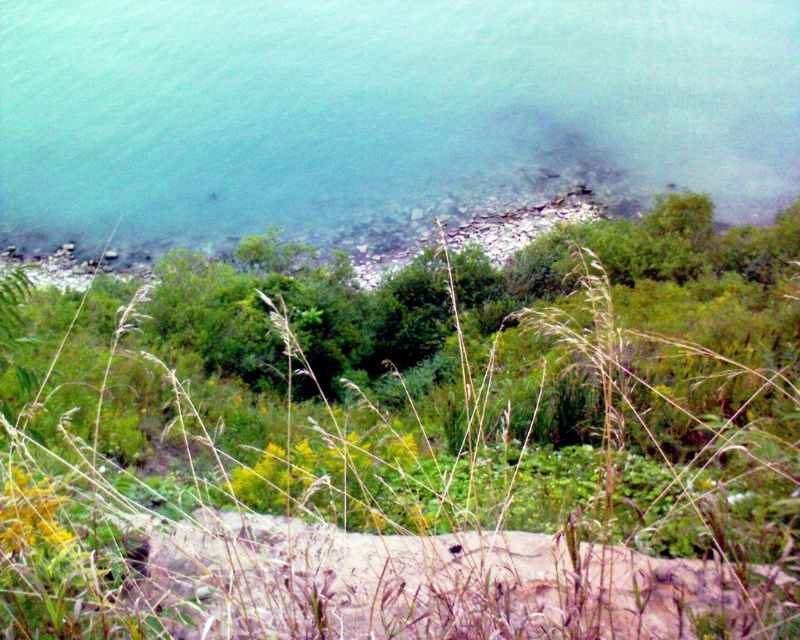
Who is positioned more to the left, green grass at center or clear water at lower left?

clear water at lower left

Does green grass at center have a smaller size compared to clear water at lower left?

Correct, green grass at center occupies less space than clear water at lower left.

At what (x,y) coordinates should I click in order to perform the action: click on green grass at center. Please return your answer as a coordinate pair (x, y). Image resolution: width=800 pixels, height=640 pixels. Looking at the image, I should click on (417, 445).